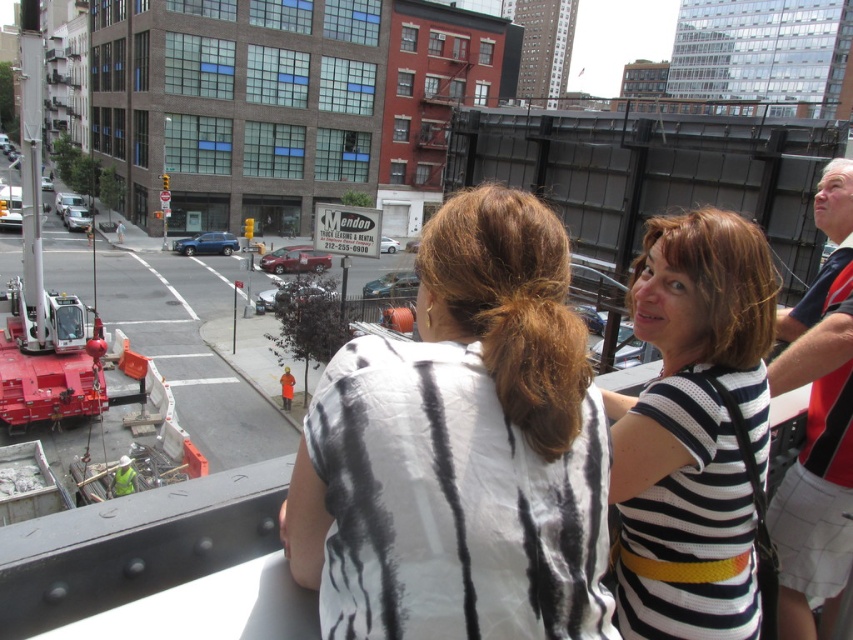
You are a photographer standing in the city scene and want to take a photo that includes both the white striped shirt at center and the white and red polo shirt at upper right. Given that your camera has a maximum focus range of 1.5 meters, will you be able to capture both subjects in focus?

The white striped shirt at center and the white and red polo shirt at upper right are 1.44 meters apart from each other. Since the distance between them is within the camera maximum focus range of 1.5 meters, both subjects can be captured in focus.

You are standing at the center of the image and want to locate the white striped shirt at center. According to the coordinates provided, in which direction should you look to find it?

The white striped shirt at center is located at coordinates point (461, 451), so you should look towards the lower right direction from the center to find it.